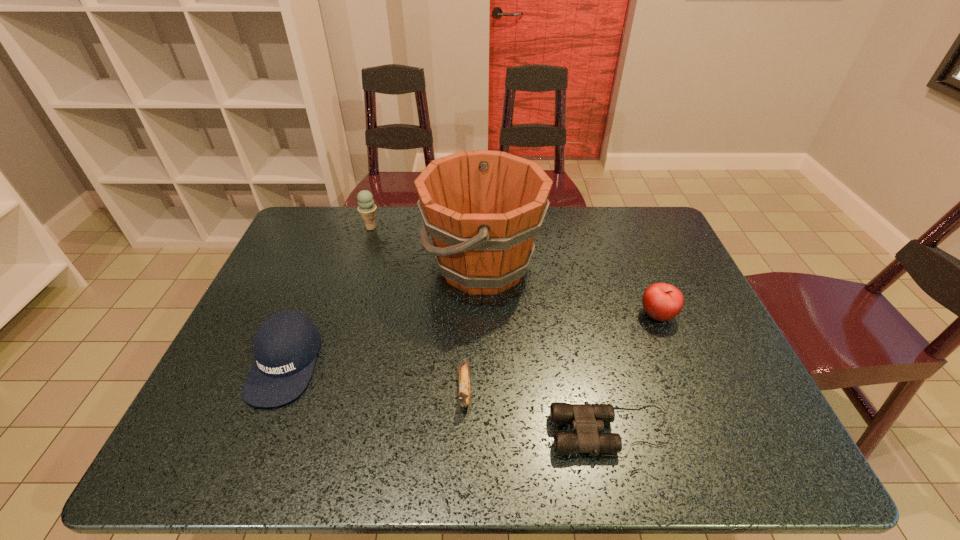
You are a GUI agent. You are given a task and a screenshot of the screen. Output one action in this format:
    pyautogui.click(x=<x>, y=<y>)
    Task: Click on the bucket
    The width and height of the screenshot is (960, 540).
    Given the screenshot: What is the action you would take?
    pyautogui.click(x=482, y=209)

You are a GUI agent. You are given a task and a screenshot of the screen. Output one action in this format:
    pyautogui.click(x=<x>, y=<y>)
    Task: Click on the fifth shortest object
    The width and height of the screenshot is (960, 540).
    Given the screenshot: What is the action you would take?
    pyautogui.click(x=367, y=209)

At what (x,y) coordinates should I click in order to perform the action: click on apple. Please return your answer as a coordinate pair (x, y). This screenshot has height=540, width=960. Looking at the image, I should click on (661, 301).

At what (x,y) coordinates should I click in order to perform the action: click on baseball cap. Please return your answer as a coordinate pair (x, y). This screenshot has height=540, width=960. Looking at the image, I should click on (285, 346).

At what (x,y) coordinates should I click in order to perform the action: click on the second shortest object. Please return your answer as a coordinate pair (x, y). Looking at the image, I should click on (464, 374).

What are the coordinates of `the shortest object` in the screenshot? It's located at (587, 419).

Identify the location of blank space located 0.130m on the handle side of the bucket. This screenshot has width=960, height=540. (380, 267).

Locate an element on the screen. free point located 0.320m on the handle side of the bucket is located at coordinates (317, 267).

Where is `vacant area situated 0.180m on the handle side of the bucket`? vacant area situated 0.180m on the handle side of the bucket is located at coordinates (364, 267).

This screenshot has height=540, width=960. I want to click on free location located on the front of the ice cream, so click(366, 245).